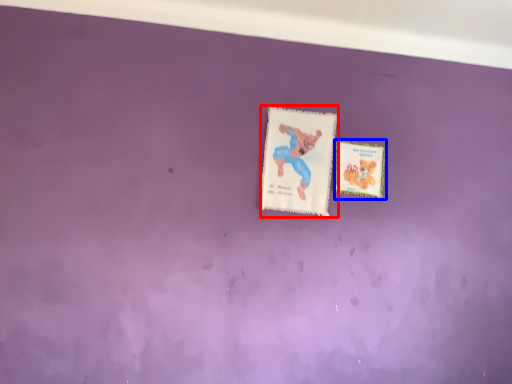
Question: Which object appears farthest to the camera in this image, postcard (highlighted by a red box) or postcard (highlighted by a blue box)?

Choices:
 (A) postcard
 (B) postcard

Answer: (B)